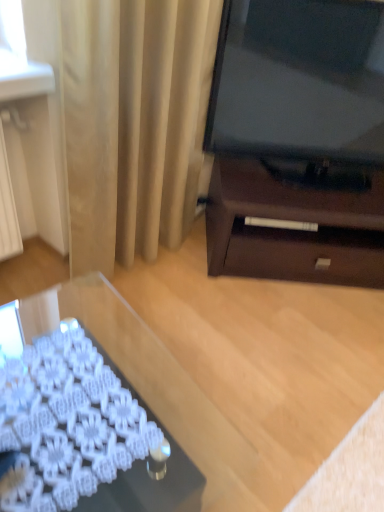
Locate an element on the screen. The height and width of the screenshot is (512, 384). vacant area to the right of beige fabric curtain at upper left is located at coordinates (211, 287).